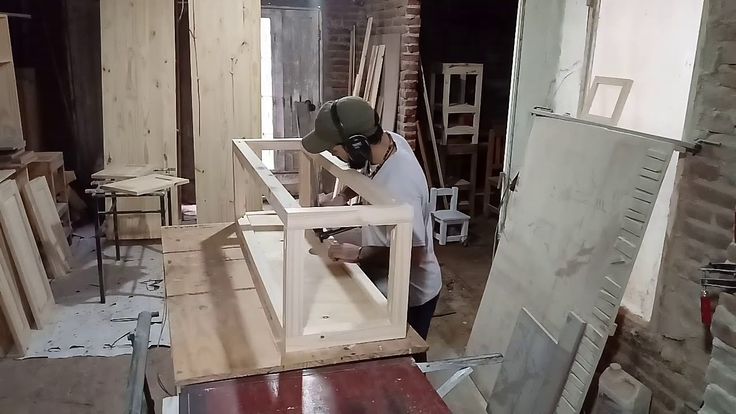
Where is `brick wall`? brick wall is located at coordinates (706, 191), (411, 79), (333, 33).